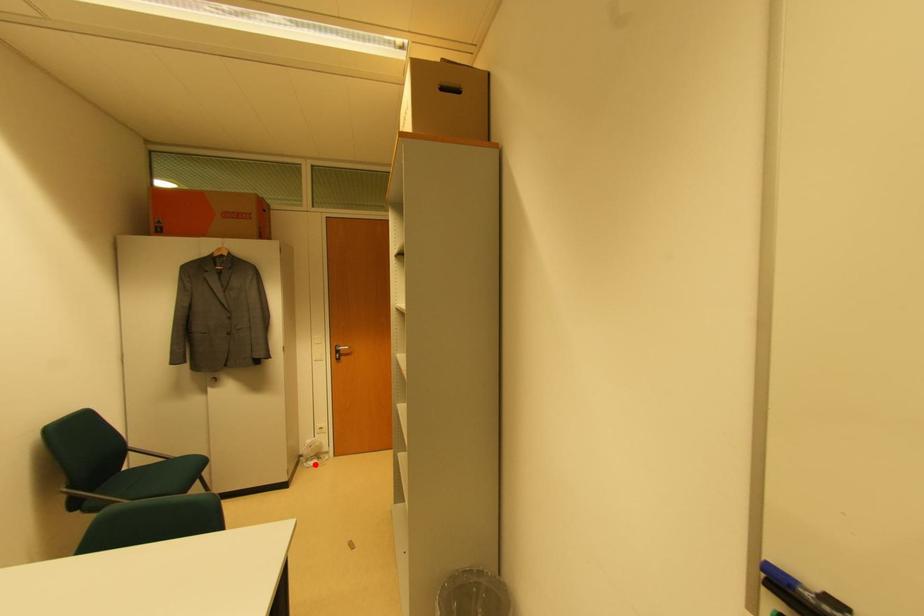
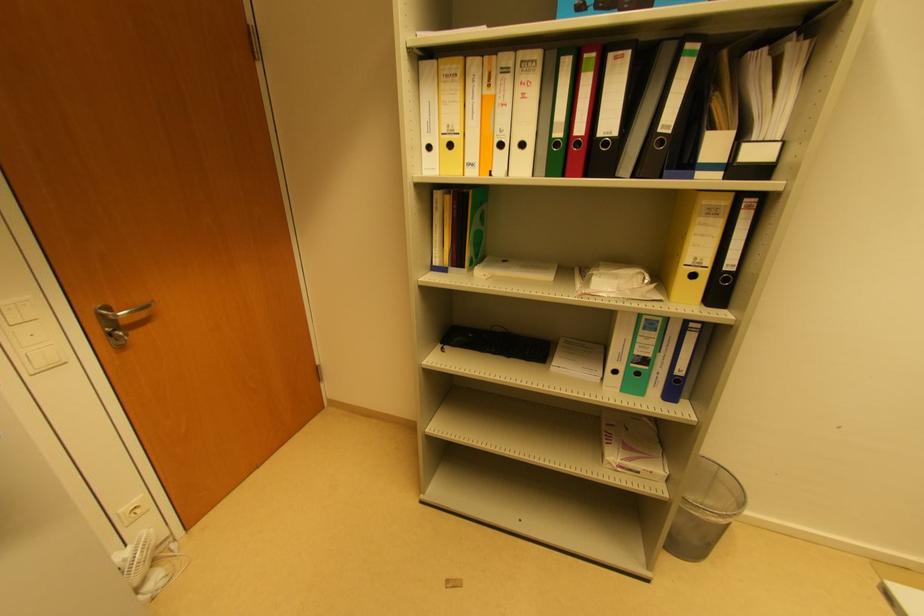
Question: A red point is marked in image1. In image2, is the corresponding 3D point closer to the camera or farther? Reply with the corresponding letter.

Choices:
 (A) The corresponding 3D point is closer.
 (B) The corresponding 3D point is farther.

Answer: (A)